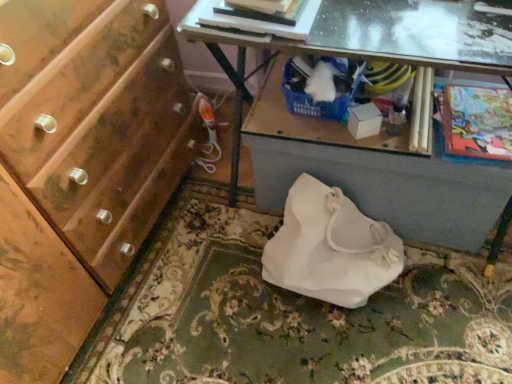
The image size is (512, 384). In order to click on vacant area that is in front of white fabric bag at center in this screenshot , I will do `click(358, 348)`.